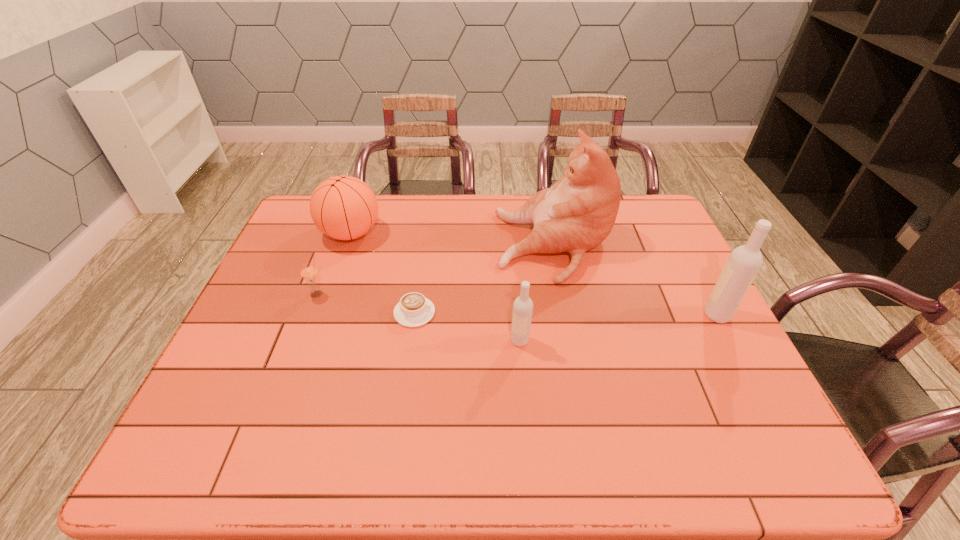
The width and height of the screenshot is (960, 540). Identify the location of straw positioned at the left edge. (309, 273).

This screenshot has width=960, height=540. Identify the location of object at the right edge. (744, 262).

Locate an element on the screen. This screenshot has width=960, height=540. object at the far left corner is located at coordinates (343, 207).

Locate an element on the screen. The image size is (960, 540). free space at the far edge of the desktop is located at coordinates (471, 220).

Locate an element on the screen. The image size is (960, 540). vacant position at the near edge of the desktop is located at coordinates (475, 387).

At what (x,y) coordinates should I click in order to perform the action: click on free space at the left edge of the desktop. Please return your answer as a coordinate pair (x, y). The width and height of the screenshot is (960, 540). Looking at the image, I should click on (315, 259).

Where is `free space at the right edge of the desktop`? Image resolution: width=960 pixels, height=540 pixels. free space at the right edge of the desktop is located at coordinates (727, 362).

Image resolution: width=960 pixels, height=540 pixels. Identify the location of free space between the rightmost object and the shortest object. (565, 314).

Where is `empty location between the fifth tallest object and the cat`? The image size is (960, 540). empty location between the fifth tallest object and the cat is located at coordinates (436, 271).

Where is `free spot between the third object from left to right and the fifth shortest object`? The image size is (960, 540). free spot between the third object from left to right and the fifth shortest object is located at coordinates (565, 314).